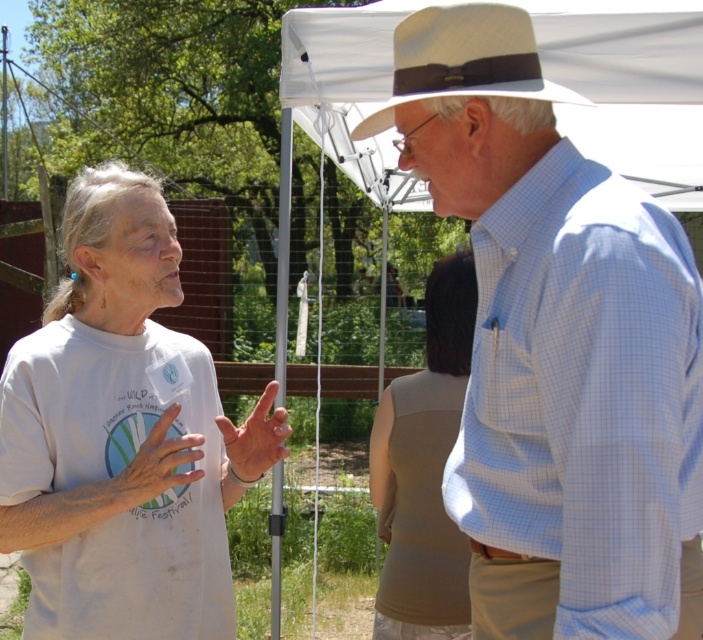
You are setting up a photography session and need to ensure that the white fabric canopy at upper center and the beige fabric tank top at center are both visible in the frame. Given their sizes, which object should you prioritize positioning closer to the camera to maintain clarity?

The white fabric canopy at upper center is smaller than the beige fabric tank top at center, so you should prioritize positioning the white fabric canopy at upper center closer to the camera to ensure it appears large enough in the frame for clarity.

You are standing at point (109, 573) and want to take a photo of the scene. The camera you are using has a focal length of 50mm and a sensor size of 24mm x 36mm. What is the minimum distance you need to move towards the camera to ensure the entire scene fits within the camera frame?

The point (109, 573) and the camera are 2.27 meters apart. To ensure the entire scene fits within the camera frame, you need to move closer to the camera so that the distance between you and the camera is less than or equal to 2.27 meters.